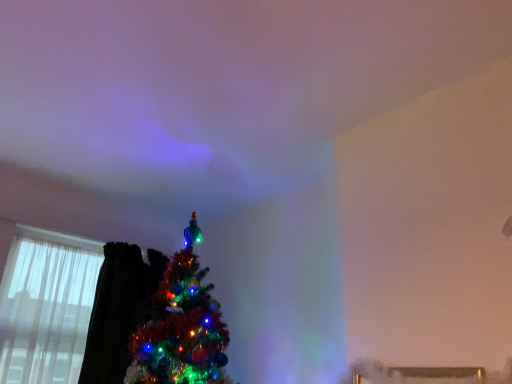
The height and width of the screenshot is (384, 512). I want to click on transparent curtain at left, so click(x=46, y=306).

Describe the element at coordinates (46, 306) in the screenshot. I see `transparent curtain at left` at that location.

What are the coordinates of `transparent curtain at left` in the screenshot? It's located at (46, 306).